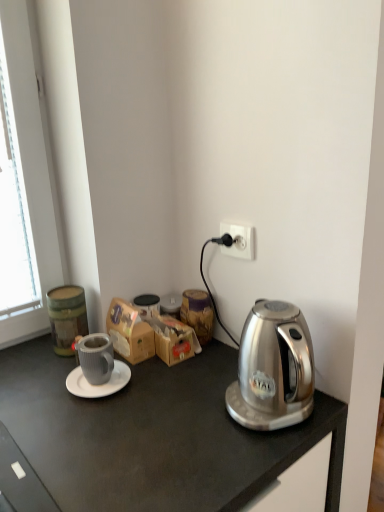
Question: From the image's perspective, relative to brown cardboard box at center, is matte gray mug at center left above or below?

Choices:
 (A) above
 (B) below

Answer: (B)

Question: Considering the relative positions of matte gray mug at center left and brown cardboard box at center in the image provided, is matte gray mug at center left to the left or to the right of brown cardboard box at center?

Choices:
 (A) right
 (B) left

Answer: (B)

Question: Which object is positioned closest to the matte gray mug at center left?

Choices:
 (A) brown cardboard box at center
 (B) white matte saucer at center
 (C) wooden jar at center
 (D) white plastic power outlet at upper right

Answer: (B)

Question: Which object is the farthest from the wooden jar at center?

Choices:
 (A) white matte saucer at center
 (B) brown cardboard box at center
 (C) white plastic power outlet at upper right
 (D) matte gray mug at center left

Answer: (A)